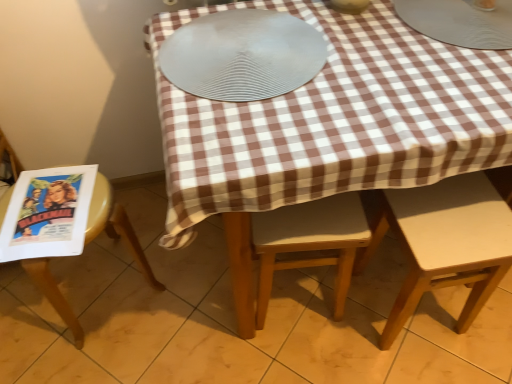
Question: Considering the relative positions of yellow plastic chair at left, marked as the 3th chair in a right-to-left arrangement, and matte paper comic book at left in the image provided, is yellow plastic chair at left, marked as the 3th chair in a right-to-left arrangement, to the left or to the right of matte paper comic book at left?

Choices:
 (A) right
 (B) left

Answer: (A)

Question: From a real-world perspective, is yellow plastic chair at left, marked as the 3th chair in a right-to-left arrangement, physically located above or below matte paper comic book at left?

Choices:
 (A) below
 (B) above

Answer: (A)

Question: Which is nearer to the metallic silver plate at upper center, which is the first tableware from left to right?

Choices:
 (A) metallic silver plate at upper right, the first tableware positioned from the right
 (B) white matte chair at lower right, marked as the 3th chair in a left-to-right arrangement
 (C) matte paper comic book at left
 (D) light brown wooden chair at center, placed as the second chair when sorted from left to right
 (E) yellow plastic chair at left, acting as the first chair starting from the left

Answer: (A)

Question: Which object is the closest to the metallic silver plate at upper center, arranged as the second tableware when viewed from the right?

Choices:
 (A) yellow plastic chair at left, acting as the first chair starting from the left
 (B) light brown wooden chair at center, placed as the second chair when sorted from left to right
 (C) white matte chair at lower right, arranged as the 1th chair when viewed from the right
 (D) metallic silver plate at upper right, the 2th tableware positioned from the left
 (E) silver textured platter at center

Answer: (D)